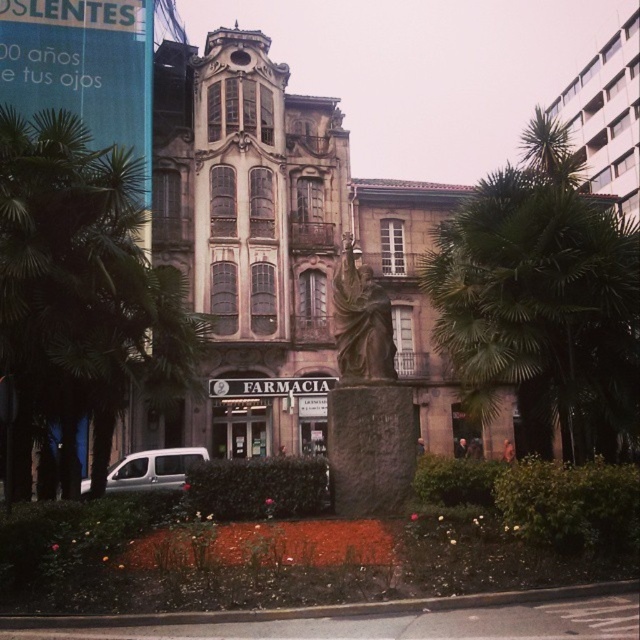
You are standing at the point marked by coordinates point (515,360) and want to walk towards the point marked by coordinates point (152,476). According to the scene, will you be moving towards the building or away from it?

Since point (515,360) is in front of point (152,476), moving from point (515,360) towards point (152,476) would mean moving away from the building, as point (152,476) is behind point (515,360) relative to the building.

You are standing at the point marked as point (584, 403). You want to take a photo of the building with the statue in the background. Is the statue visible in the frame?

The distance of point (584, 403) from viewer is 49.10 meters. Since the statue is in front of the building, it would be closer to you than the building. However, the statue is positioned centrally within a landscaped area in front of the building. The statue might be between you and the building, so it could block part of the building in the photo. But since you are 49.10 meters away, the statue might still be visible in the background depending on the camera angle and zoom. However, based on the given 49